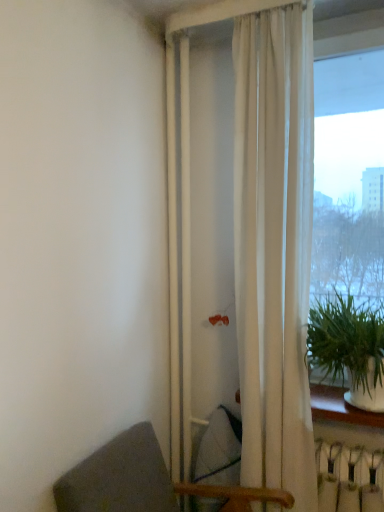
At what (x,y) coordinates should I click in order to perform the action: click on white sheer curtain at center. Please return your answer as a coordinate pair (x, y). Image resolution: width=384 pixels, height=512 pixels. Looking at the image, I should click on (272, 236).

Measure the distance between point [377,391] and camera.

Point [377,391] and camera are 5.42 feet apart from each other.

This screenshot has width=384, height=512. What do you see at coordinates (348, 175) in the screenshot?
I see `transparent glass window at right` at bounding box center [348, 175].

What is the approximate width of transparent glass window at right?

The width of transparent glass window at right is 2.81 inches.

Locate an element on the screen. Image resolution: width=384 pixels, height=512 pixels. white plastic radiator at lower right is located at coordinates (348, 479).

Between white plastic radiator at lower right and transparent glass window at right, which one has smaller size?

white plastic radiator at lower right is smaller.

From the image's perspective, which is above, white plastic radiator at lower right or transparent glass window at right?

From the image's view, transparent glass window at right is above.

Is white plastic radiator at lower right wider than transparent glass window at right?

Yes.

Is the depth of white plastic radiator at lower right greater than that of transparent glass window at right?

No, white plastic radiator at lower right is closer to the camera.

Who is bigger, white plastic radiator at lower right or white sheer curtain at center?

With larger size is white sheer curtain at center.

Can white sheer curtain at center be found inside white plastic radiator at lower right?

No, white sheer curtain at center is not a part of white plastic radiator at lower right.

Is white plastic radiator at lower right directly adjacent to white sheer curtain at center?

No, white plastic radiator at lower right is not beside white sheer curtain at center.

Which object is closer to the camera taking this photo, white plastic radiator at lower right or white sheer curtain at center?

white sheer curtain at center is in front.

In the image, is dark gray fabric chair at lower left positioned in front of or behind green leafy plant at right?

Visually, dark gray fabric chair at lower left is located in front of green leafy plant at right.

Considering the sizes of dark gray fabric chair at lower left and green leafy plant at right in the image, is dark gray fabric chair at lower left taller or shorter than green leafy plant at right?

Considering their sizes, dark gray fabric chair at lower left has more height than green leafy plant at right.

You are a GUI agent. You are given a task and a screenshot of the screen. Output one action in this format:
    pyautogui.click(x=<x>, y=<y>)
    Task: Click on the houseplant above the dark gray fabric chair at lower left (from the image's perspective)
    Image resolution: width=384 pixels, height=512 pixels.
    Given the screenshot: What is the action you would take?
    pyautogui.click(x=349, y=349)

In the scene shown: Can you tell me how much transparent glass window at right and white sheer curtain at center differ in facing direction?

There is a 0.319-degree angle between the facing directions of transparent glass window at right and white sheer curtain at center.

Are transparent glass window at right and white sheer curtain at center making contact?

No.

Would you say transparent glass window at right is inside or outside white sheer curtain at center?

transparent glass window at right exists outside the volume of white sheer curtain at center.

From a real-world perspective, is transparent glass window at right on top of white sheer curtain at center?

Correct, in the physical world, transparent glass window at right is higher than white sheer curtain at center.

How distant is white sheer curtain at center from dark gray fabric chair at lower left?

white sheer curtain at center and dark gray fabric chair at lower left are 25.81 inches apart.

Is point (245, 130) closer or farther from the camera than point (149, 490)?

Point (245, 130) is positioned farther from the camera compared to point (149, 490).

Where is `chair located in front of the white sheer curtain at center`? This screenshot has height=512, width=384. chair located in front of the white sheer curtain at center is located at coordinates (144, 481).

From the picture: Is white sheer curtain at center at the right side of dark gray fabric chair at lower left?

Correct, you'll find white sheer curtain at center to the right of dark gray fabric chair at lower left.

Identify the location of window lying behind the dark gray fabric chair at lower left. (348, 175).

Is dark gray fabric chair at lower left oriented away from transparent glass window at right?

No, dark gray fabric chair at lower left's orientation is not away from transparent glass window at right.

Is dark gray fabric chair at lower left to the right of transparent glass window at right from the viewer's perspective?

No, dark gray fabric chair at lower left is not to the right of transparent glass window at right.

Considering the positions of objects dark gray fabric chair at lower left and transparent glass window at right in the image provided, who is behind, dark gray fabric chair at lower left or transparent glass window at right?

transparent glass window at right is behind.

From the image's perspective, which is above, transparent glass window at right or dark gray fabric chair at lower left?

transparent glass window at right is shown above in the image.

Is transparent glass window at right facing towards dark gray fabric chair at lower left?

No, transparent glass window at right does not turn towards dark gray fabric chair at lower left.

Based on the photo, is transparent glass window at right at the right side of dark gray fabric chair at lower left?

Yes, transparent glass window at right is to the right of dark gray fabric chair at lower left.

You are a GUI agent. You are given a task and a screenshot of the screen. Output one action in this format:
    pyautogui.click(x=<x>, y=<y>)
    Task: Click on the radiator in front of the transparent glass window at right
    
    Given the screenshot: What is the action you would take?
    pyautogui.click(x=348, y=479)

Locate an element on the screen. Image resolution: width=384 pixels, height=512 pixels. curtain above the white plastic radiator at lower right (from a real-world perspective) is located at coordinates (272, 236).

Looking at the image, which one is located further to white sheer curtain at center, transparent glass window at right or white plastic radiator at lower right?

Among the two, transparent glass window at right is located further to white sheer curtain at center.

Consider the image. From the image, which object appears to be nearer to white sheer curtain at center, green leafy plant at right or white plastic radiator at lower right?

green leafy plant at right.

Which object lies nearer to the anchor point dark gray fabric chair at lower left, white plastic radiator at lower right or green leafy plant at right?

The object closer to dark gray fabric chair at lower left is white plastic radiator at lower right.

Estimate the real-world distances between objects in this image. Which object is further from green leafy plant at right, white plastic radiator at lower right or white sheer curtain at center?

Among the two, white plastic radiator at lower right is located further to green leafy plant at right.

From the picture: Considering their positions, is dark gray fabric chair at lower left positioned closer to transparent glass window at right than white sheer curtain at center?

white sheer curtain at center is closer to transparent glass window at right.

Estimate the real-world distances between objects in this image. Which object is further from dark gray fabric chair at lower left, white sheer curtain at center or transparent glass window at right?

Based on the image, transparent glass window at right appears to be further to dark gray fabric chair at lower left.

From the image, which object appears to be nearer to white plastic radiator at lower right, green leafy plant at right or transparent glass window at right?

The object closer to white plastic radiator at lower right is green leafy plant at right.

Considering their positions, is transparent glass window at right positioned closer to dark gray fabric chair at lower left than green leafy plant at right?

green leafy plant at right is closer to dark gray fabric chair at lower left.

I want to click on curtain between transparent glass window at right and dark gray fabric chair at lower left from top to bottom, so click(x=272, y=236).

Locate an element on the screen. The image size is (384, 512). chair between transparent glass window at right and white plastic radiator at lower right in the up-down direction is located at coordinates (144, 481).

I want to click on houseplant between dark gray fabric chair at lower left and white plastic radiator at lower right, so click(x=349, y=349).

Find the location of a particular element. The image size is (384, 512). curtain between transparent glass window at right and white plastic radiator at lower right from top to bottom is located at coordinates (272, 236).